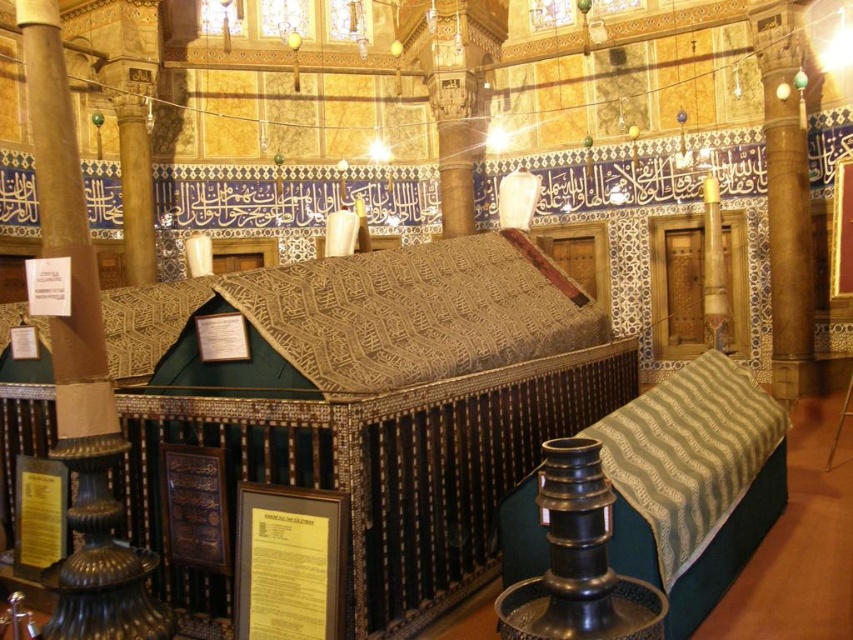
Question: Can you confirm if polished marble pillar at center is positioned to the right of wooden column at right?

Choices:
 (A) no
 (B) yes

Answer: (A)

Question: Can you confirm if polished marble pillar at center is positioned to the right of white marble column at right?

Choices:
 (A) no
 (B) yes

Answer: (A)

Question: Does polished marble pillar at center appear on the left side of white marble column at right?

Choices:
 (A) no
 (B) yes

Answer: (B)

Question: Which object is farther from the camera taking this photo?

Choices:
 (A) white marble column at right
 (B) wooden column at right
 (C) polished marble pillar at center

Answer: (B)

Question: Which object is the farthest from the polished marble pillar at center?

Choices:
 (A) wooden column at right
 (B) white marble column at right

Answer: (A)

Question: Considering the real-world distances, which object is farthest from the white marble column at right?

Choices:
 (A) wooden column at right
 (B) polished marble pillar at center

Answer: (B)